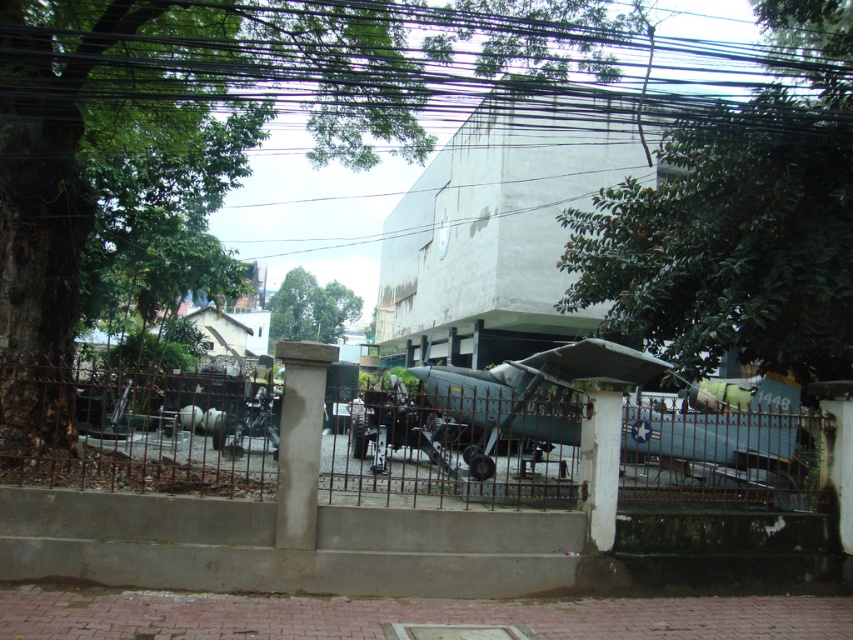
You are a photographer setting up equipment to capture the military aircraft. You notice the black wire at upper center and the rusty metal fence at center in your frame. Which object appears thicker in the photo?

The black wire at upper center appears thicker because its width is larger than the rusty metal fence at center.

You are a security guard patrolling the area around the vintage U.S. military plane. You notice the black wire at upper center and the rusty metal fence at center. Which object is located to the right of the other?

The black wire at upper center is positioned on the right side of the rusty metal fence at center.

You are a security guard at the museum. You notice two items in the scene that need maintenance. The black wire at upper center and the rusty metal fence at center. Which one of these items is larger in size?

The black wire at upper center is bigger than the rusty metal fence at center, so the black wire at upper center is larger in size and requires attention first.